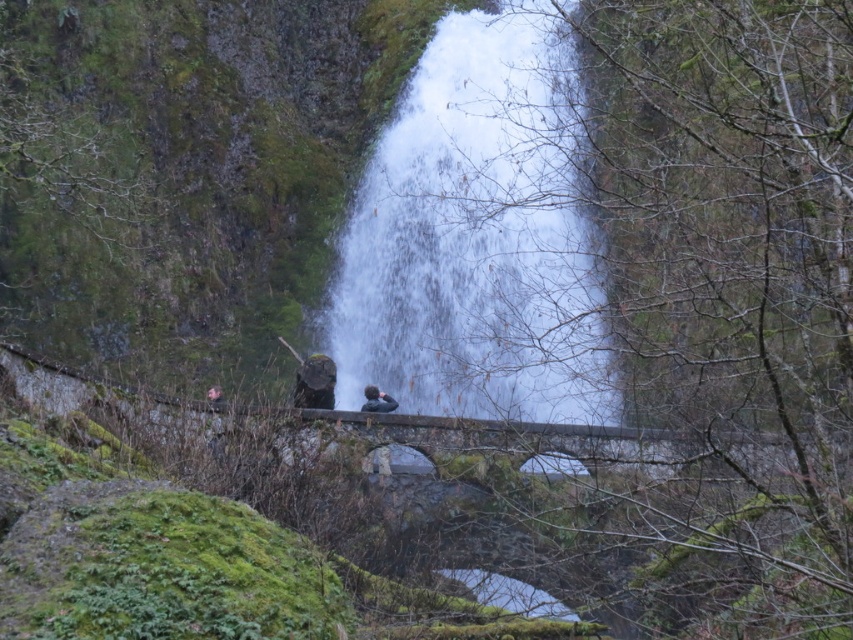
Does dark gray fabric jacket at center appear under brown leather jacket at lower left?

Indeed, dark gray fabric jacket at center is positioned under brown leather jacket at lower left.

Does dark gray fabric jacket at center have a greater width compared to brown leather jacket at lower left?

No.

Where is `dark gray fabric jacket at center`? The image size is (853, 640). dark gray fabric jacket at center is located at coordinates (376, 401).

Where is `dark gray fabric jacket at center`? The width and height of the screenshot is (853, 640). dark gray fabric jacket at center is located at coordinates (376, 401).

Is point (555, 298) positioned behind point (368, 396)?

That is False.

Does white frothy water at center have a smaller size compared to dark gray fabric jacket at center?

No, white frothy water at center is not smaller than dark gray fabric jacket at center.

Where is `white frothy water at center`? white frothy water at center is located at coordinates pos(466,244).

Between white frothy water at center and brown leather jacket at lower left, which one appears on the left side from the viewer's perspective?

From the viewer's perspective, brown leather jacket at lower left appears more on the left side.

Can you confirm if white frothy water at center is wider than brown leather jacket at lower left?

Yes, white frothy water at center is wider than brown leather jacket at lower left.

Who is more distant from viewer, (456,312) or (213,388)?

The point (456,312) is more distant.

Image resolution: width=853 pixels, height=640 pixels. Find the location of `white frothy water at center`. white frothy water at center is located at coordinates (466, 244).